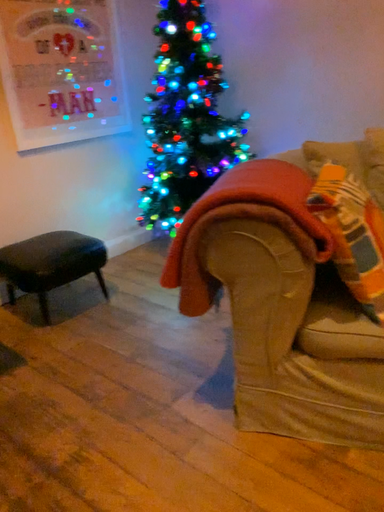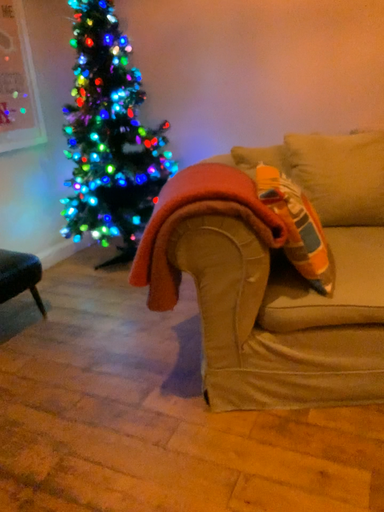
Question: Which way did the camera rotate in the video?

Choices:
 (A) rotated left
 (B) rotated right

Answer: (B)